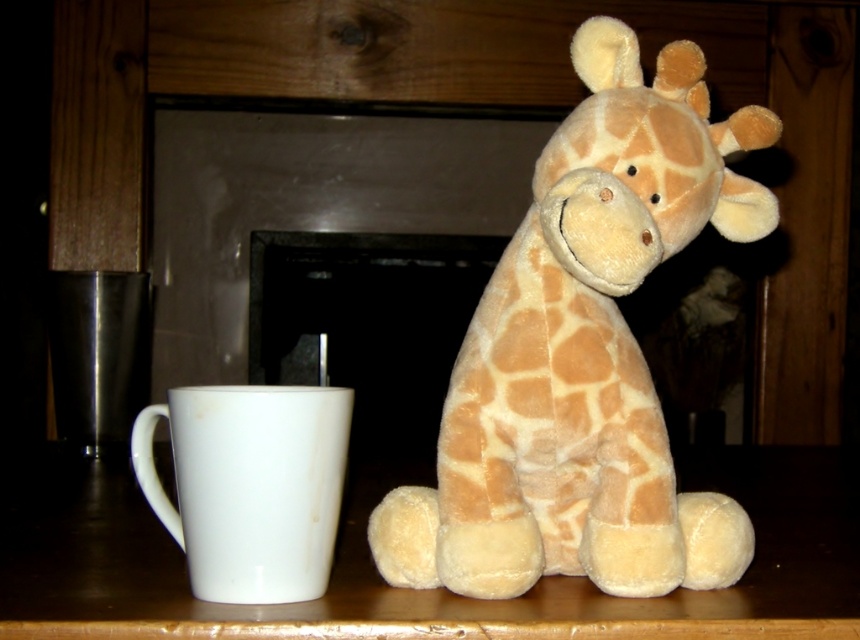
Question: Which point is closer to the camera?

Choices:
 (A) smooth wooden table at center
 (B) soft plush giraffe at center

Answer: (A)

Question: In this image, where is soft plush giraffe at center located relative to white glossy mug at left?

Choices:
 (A) right
 (B) left

Answer: (A)

Question: Which point is farther to the camera?

Choices:
 (A) smooth wooden table at center
 (B) white glossy mug at left
 (C) soft plush giraffe at center

Answer: (B)

Question: Which of the following is the farthest from the observer?

Choices:
 (A) soft plush giraffe at center
 (B) smooth wooden table at center

Answer: (A)

Question: Does smooth wooden table at center have a lesser width compared to white glossy mug at left?

Choices:
 (A) no
 (B) yes

Answer: (A)

Question: Observing the image, what is the correct spatial positioning of soft plush giraffe at center in reference to smooth wooden table at center?

Choices:
 (A) below
 (B) above

Answer: (B)